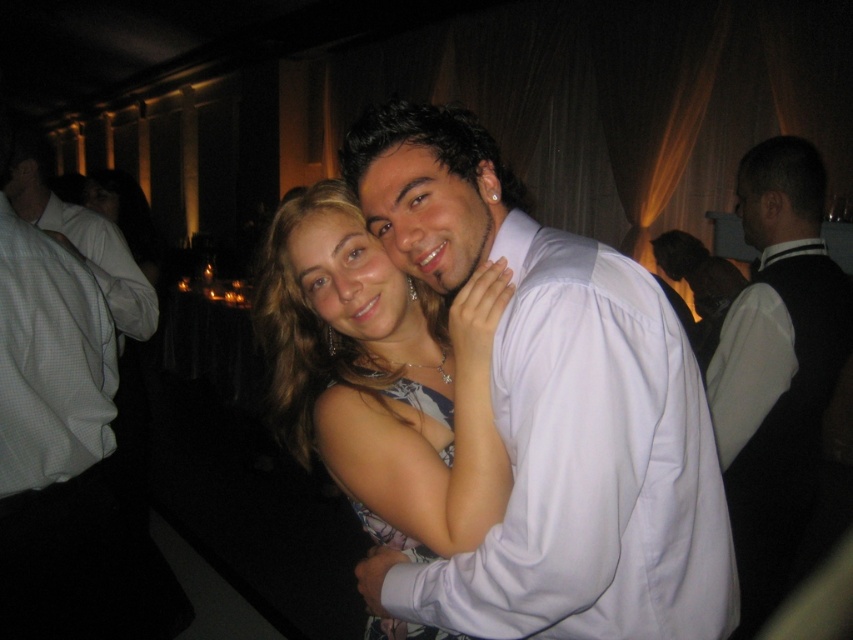
You are a photographer at a formal event. You need to position the white checkered shirt at left and the floral print fabric dress at center in your frame. If the camera lens can only accommodate objects up to 1.2 meters wide, will both fit within the frame if placed side by side?

The white checkered shirt at left might be wider than the floral print fabric dress at center, but without knowing the exact widths, it is uncertain if both will fit within the 1.2 meters frame. Additional measurements are needed.

You are a photographer holding a camera and want to take a closeup shot of the white satin shirt at center. The camera requires a minimum distance of 25 inches to focus properly. Can you take the photo without moving closer?

The white satin shirt at center and camera are 30.59 inches apart from each other, so yes, the photographer can take the photo without moving closer because the distance is sufficient for the camera to focus properly.